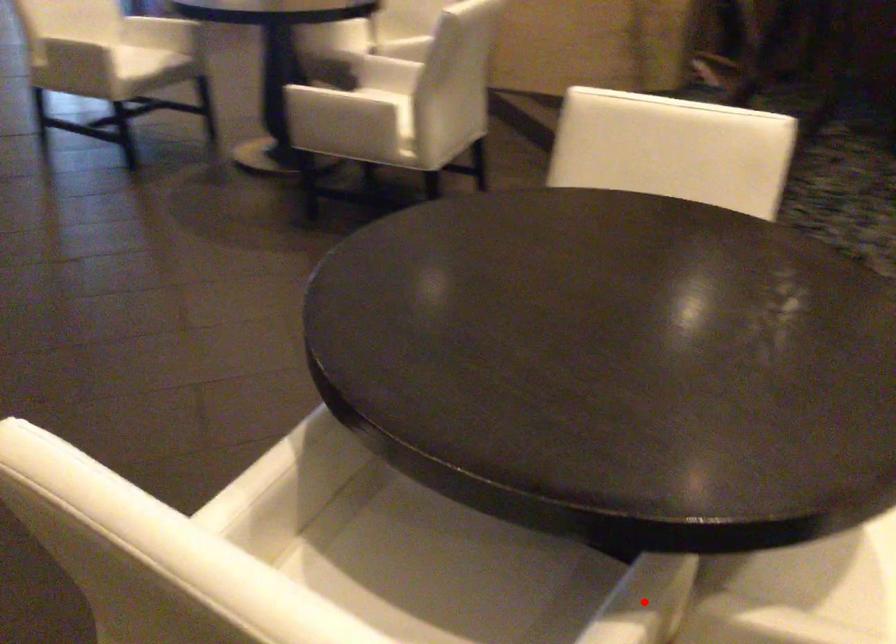
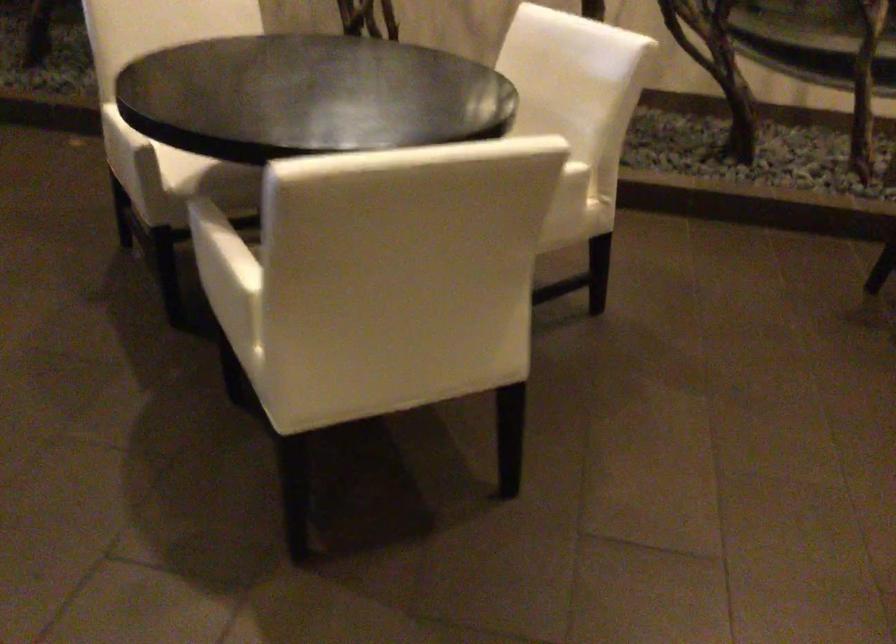
Question: I am providing you with two images of the same scene from different viewpoints. A red point is marked on the first image. Is the red point's position out of view in image 2?

Choices:
 (A) Yes
 (B) No

Answer: (A)